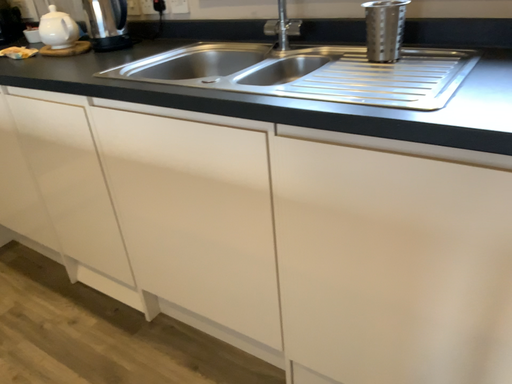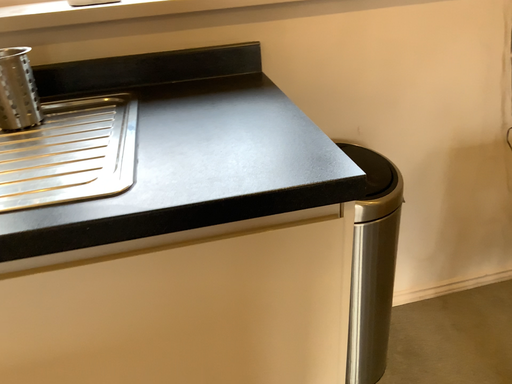
Question: How did the camera likely rotate when shooting the video?

Choices:
 (A) rotated right
 (B) rotated left

Answer: (A)